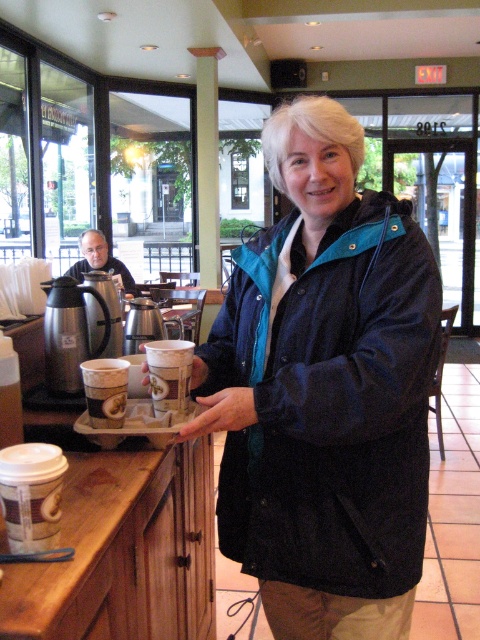
You are a customer at the coffee shop and you see the white paper cup at center and the smooth skin hand at center. Which object is bigger?

The white paper cup at center is larger in size than the smooth skin hand at center.